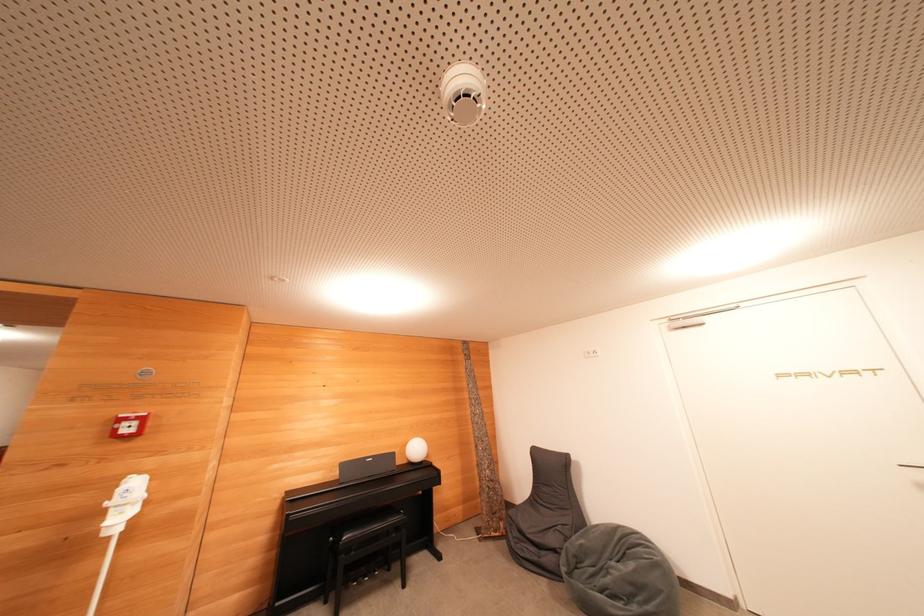
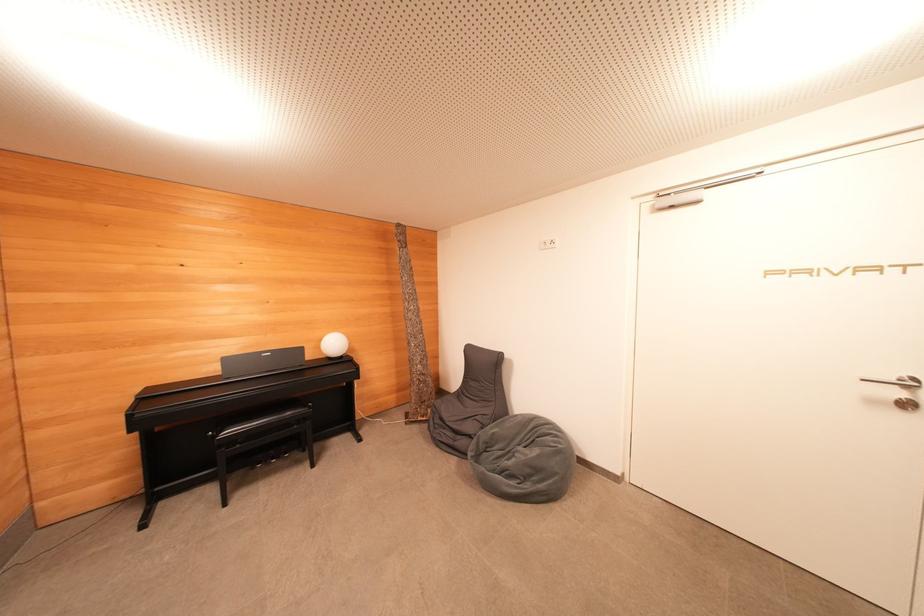
Find the pixel in the second image that matches the point at 346,469 in the first image.

(229, 363)